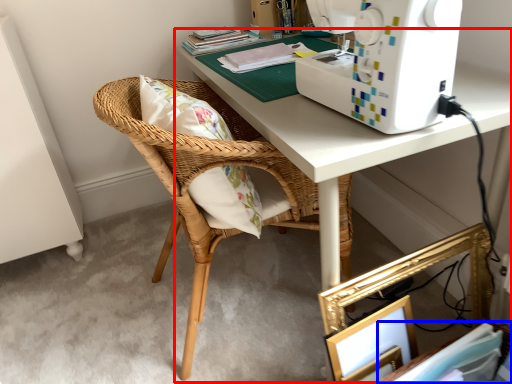
Question: Which object is further to the camera taking this photo, desk (highlighted by a red box) or book (highlighted by a blue box)?

Choices:
 (A) desk
 (B) book

Answer: (B)